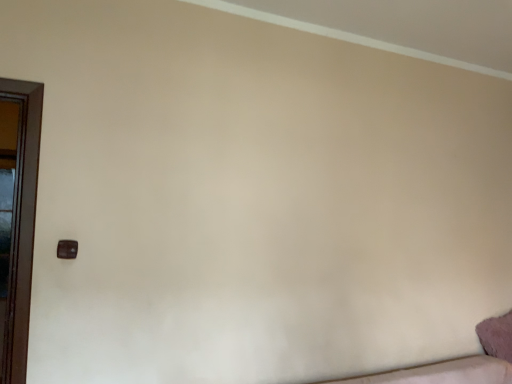
Question: Is matte brown door handle at lower left facing away from fuzzy pink pillow at lower right?

Choices:
 (A) no
 (B) yes

Answer: (A)

Question: Can you confirm if matte brown door handle at lower left is positioned to the right of fuzzy pink pillow at lower right?

Choices:
 (A) no
 (B) yes

Answer: (A)

Question: Considering the relative sizes of matte brown door handle at lower left and fuzzy pink pillow at lower right in the image provided, is matte brown door handle at lower left wider than fuzzy pink pillow at lower right?

Choices:
 (A) yes
 (B) no

Answer: (B)

Question: Is matte brown door handle at lower left far away from fuzzy pink pillow at lower right?

Choices:
 (A) no
 (B) yes

Answer: (B)

Question: Does matte brown door handle at lower left have a smaller size compared to fuzzy pink pillow at lower right?

Choices:
 (A) yes
 (B) no

Answer: (A)

Question: Can you see matte brown door handle at lower left touching fuzzy pink pillow at lower right?

Choices:
 (A) yes
 (B) no

Answer: (B)

Question: Is fuzzy pink pillow at lower right located outside matte brown door handle at lower left?

Choices:
 (A) yes
 (B) no

Answer: (A)

Question: From a real-world perspective, is fuzzy pink pillow at lower right physically below matte brown door handle at lower left?

Choices:
 (A) no
 (B) yes

Answer: (B)

Question: Considering the relative sizes of fuzzy pink pillow at lower right and matte brown door handle at lower left in the image provided, is fuzzy pink pillow at lower right taller than matte brown door handle at lower left?

Choices:
 (A) no
 (B) yes

Answer: (B)

Question: Is fuzzy pink pillow at lower right positioned with its back to matte brown door handle at lower left?

Choices:
 (A) no
 (B) yes

Answer: (A)

Question: Is fuzzy pink pillow at lower right to the left of matte brown door handle at lower left from the viewer's perspective?

Choices:
 (A) no
 (B) yes

Answer: (A)

Question: Considering the relative sizes of fuzzy pink pillow at lower right and matte brown door handle at lower left in the image provided, is fuzzy pink pillow at lower right bigger than matte brown door handle at lower left?

Choices:
 (A) no
 (B) yes

Answer: (B)

Question: Is matte brown door handle at lower left inside the boundaries of fuzzy pink pillow at lower right, or outside?

Choices:
 (A) inside
 (B) outside

Answer: (B)